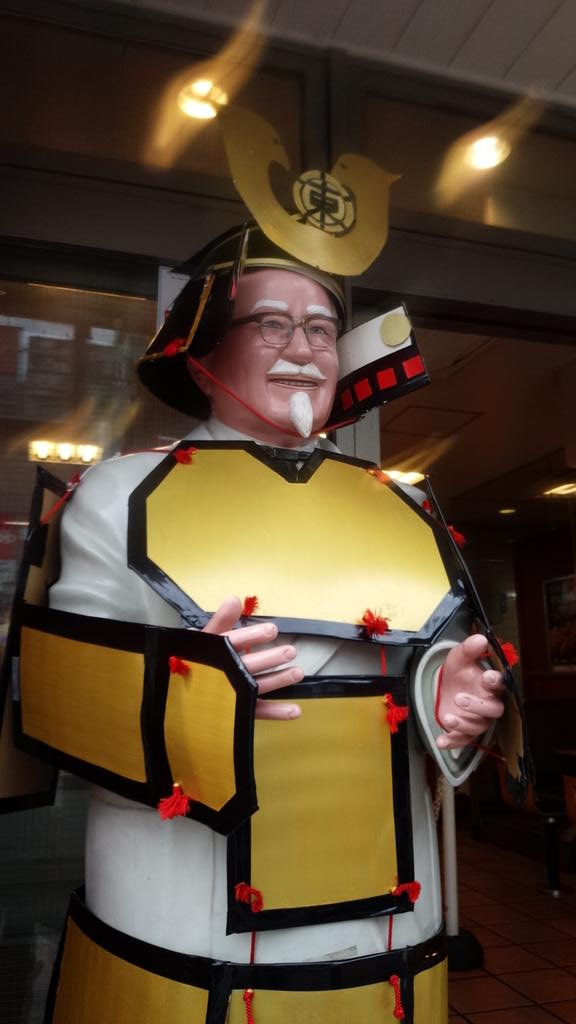
You are a GUI agent. You are given a task and a screenshot of the screen. Output one action in this format:
    pyautogui.click(x=<x>, y=<y>)
    Task: Click on the lights
    The width and height of the screenshot is (576, 1024).
    Given the screenshot: What is the action you would take?
    pyautogui.click(x=63, y=447), pyautogui.click(x=415, y=475), pyautogui.click(x=559, y=487)